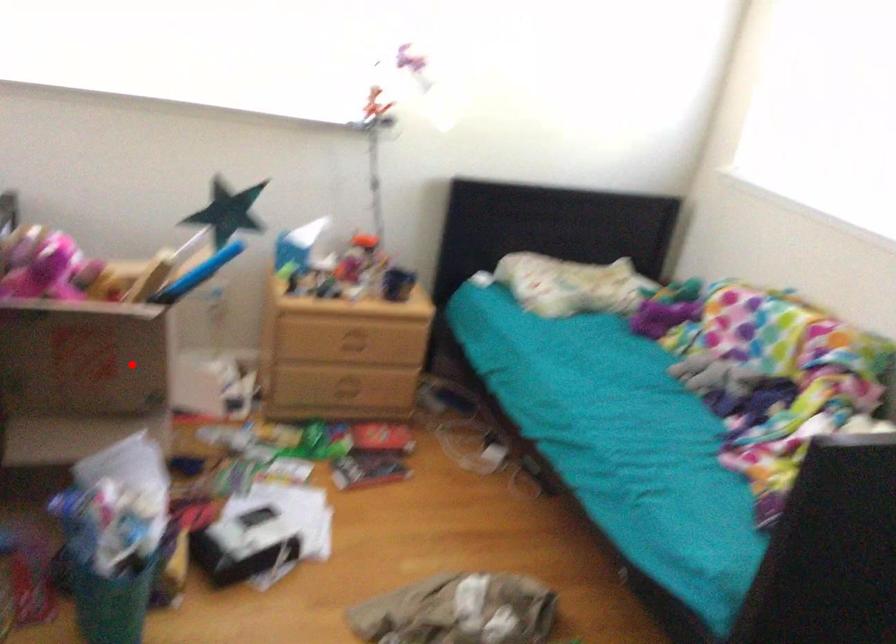
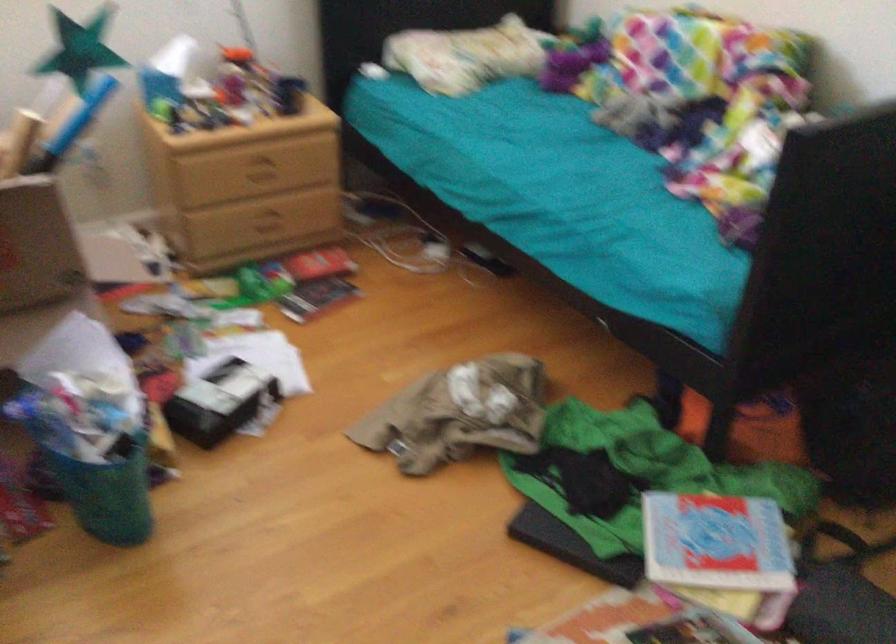
Find the pixel in the second image that matches the highlighted location in the first image.

(36, 245)